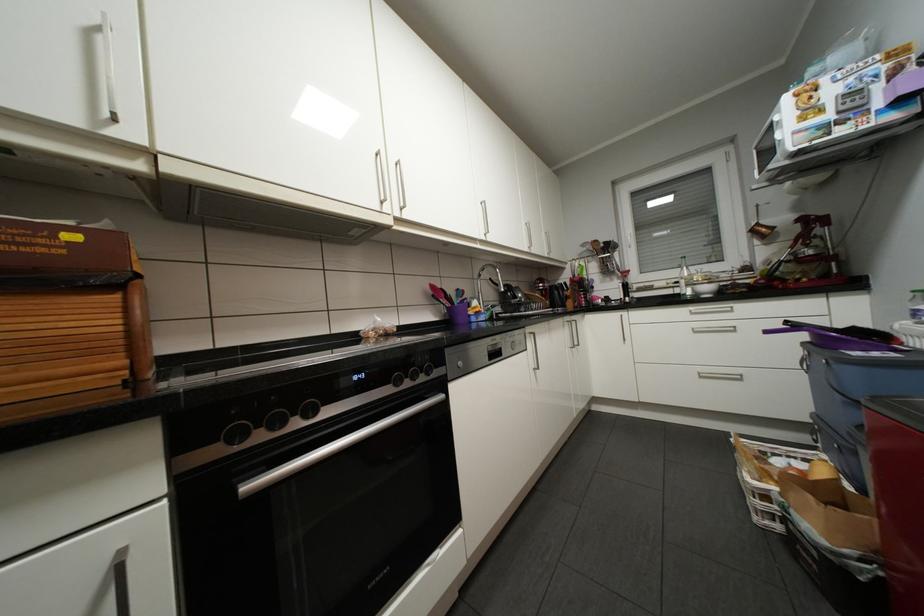
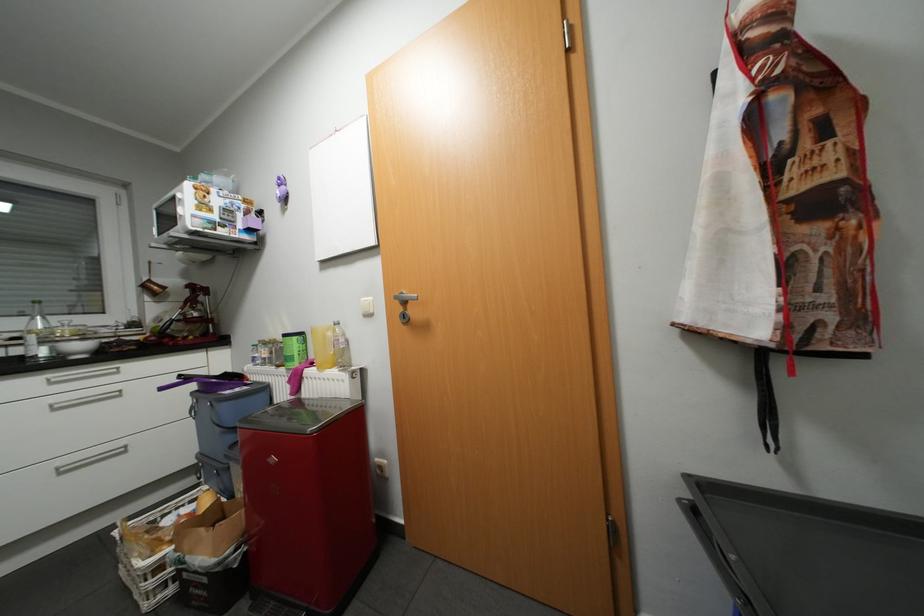
In the second image, find the point that corresponds to point 687,294 in the first image.

(30, 357)